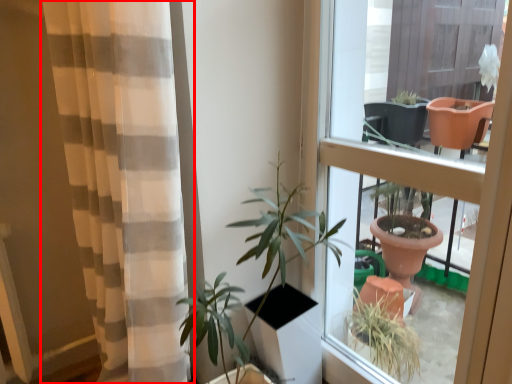
Question: From the image's perspective, what is the correct spatial relationship of curtain (annotated by the red box) in relation to window?

Choices:
 (A) above
 (B) below

Answer: (B)